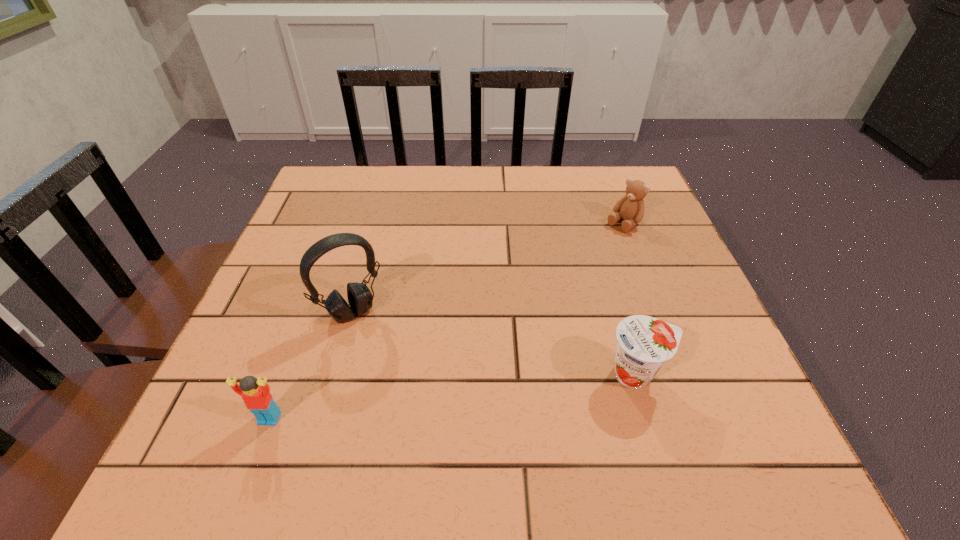
The width and height of the screenshot is (960, 540). In order to click on object situated at the near right corner in this screenshot , I will do `click(644, 344)`.

The height and width of the screenshot is (540, 960). Find the location of `vacant point at the far edge`. vacant point at the far edge is located at coordinates (554, 175).

In the image, there is a desktop. Identify the location of free space at the near edge. The height and width of the screenshot is (540, 960). (426, 408).

This screenshot has height=540, width=960. I want to click on vacant space at the left edge of the desktop, so click(x=274, y=266).

The image size is (960, 540). I want to click on vacant space at the right edge of the desktop, so click(673, 293).

The image size is (960, 540). Find the location of `vacant area at the far left corner`. vacant area at the far left corner is located at coordinates (324, 213).

In the image, there is a desktop. Identify the location of free space at the far right corner. The image size is (960, 540). (589, 194).

Locate an element on the screen. unoccupied area between the farthest object and the third nearest object is located at coordinates (488, 268).

Locate an element on the screen. empty space that is in between the teddy bear and the tallest object is located at coordinates (488, 268).

Where is `vacant area between the teddy bear and the yogurt`? The image size is (960, 540). vacant area between the teddy bear and the yogurt is located at coordinates (630, 299).